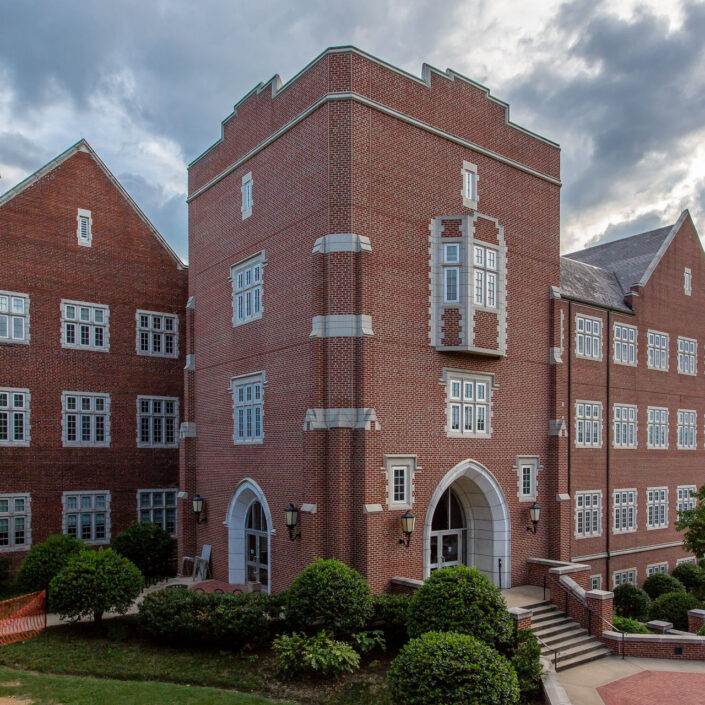
You are a GUI agent. You are given a task and a screenshot of the screen. Output one action in this format:
    pyautogui.click(x=<x>, y=<y>)
    Task: Click on the hand rails
    The width and height of the screenshot is (705, 705).
    Given the screenshot: What is the action you would take?
    pyautogui.click(x=553, y=658), pyautogui.click(x=600, y=619)